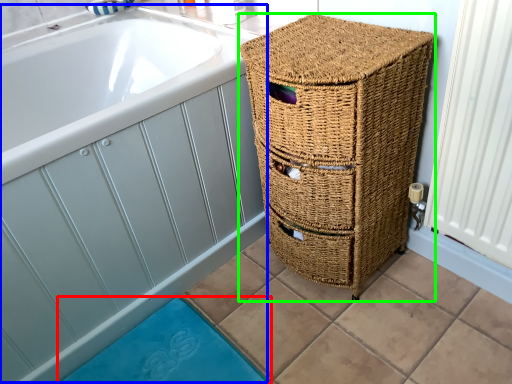
Question: Based on their relative distances, which object is farther from bath mat (highlighted by a red box)? Choose from bath (highlighted by a blue box) and furniture (highlighted by a green box).

Choices:
 (A) bath
 (B) furniture

Answer: (B)